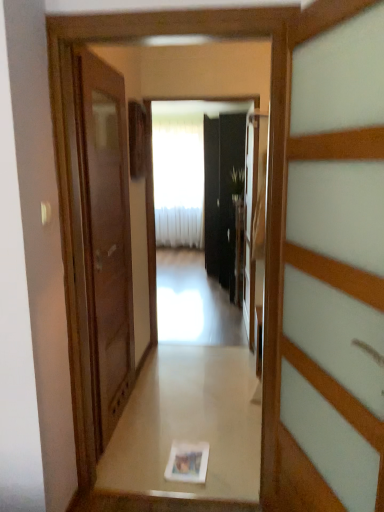
The image size is (384, 512). Identify the location of free point below glossy black mirror at center (from a real-world perspective). (198, 344).